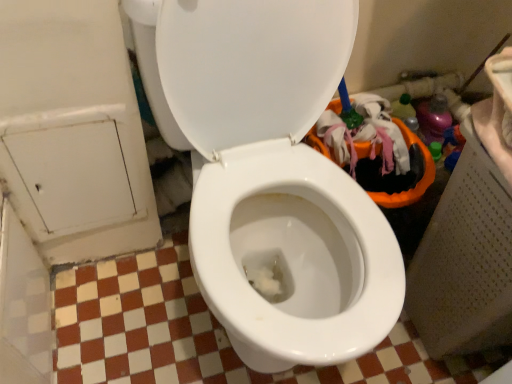
Question: Does white powder at center have a greater width compared to white glossy toilet at center?

Choices:
 (A) yes
 (B) no

Answer: (B)

Question: Is white powder at center with white glossy toilet at center?

Choices:
 (A) yes
 (B) no

Answer: (B)

Question: Does white powder at center appear on the right side of white glossy toilet at center?

Choices:
 (A) yes
 (B) no

Answer: (A)

Question: Is white powder at center bigger than white glossy toilet at center?

Choices:
 (A) yes
 (B) no

Answer: (B)

Question: Considering the relative positions of white powder at center and white glossy toilet at center in the image provided, is white powder at center to the left of white glossy toilet at center from the viewer's perspective?

Choices:
 (A) no
 (B) yes

Answer: (A)

Question: Is white powder at center positioned with its back to white glossy toilet at center?

Choices:
 (A) no
 (B) yes

Answer: (B)

Question: Is white glossy toilet at center at the left side of white powder at center?

Choices:
 (A) no
 (B) yes

Answer: (B)

Question: From the image's perspective, is white glossy toilet at center located above white powder at center?

Choices:
 (A) yes
 (B) no

Answer: (A)

Question: Considering the relative sizes of white glossy toilet at center and white powder at center in the image provided, is white glossy toilet at center bigger than white powder at center?

Choices:
 (A) no
 (B) yes

Answer: (B)

Question: Is white glossy toilet at center positioned with its back to white powder at center?

Choices:
 (A) yes
 (B) no

Answer: (B)

Question: Does white glossy toilet at center touch white powder at center?

Choices:
 (A) no
 (B) yes

Answer: (A)

Question: From the image's perspective, is white glossy toilet at center under white powder at center?

Choices:
 (A) no
 (B) yes

Answer: (A)

Question: Based on their positions, is white powder at center located to the left or right of white glossy toilet at center?

Choices:
 (A) left
 (B) right

Answer: (B)